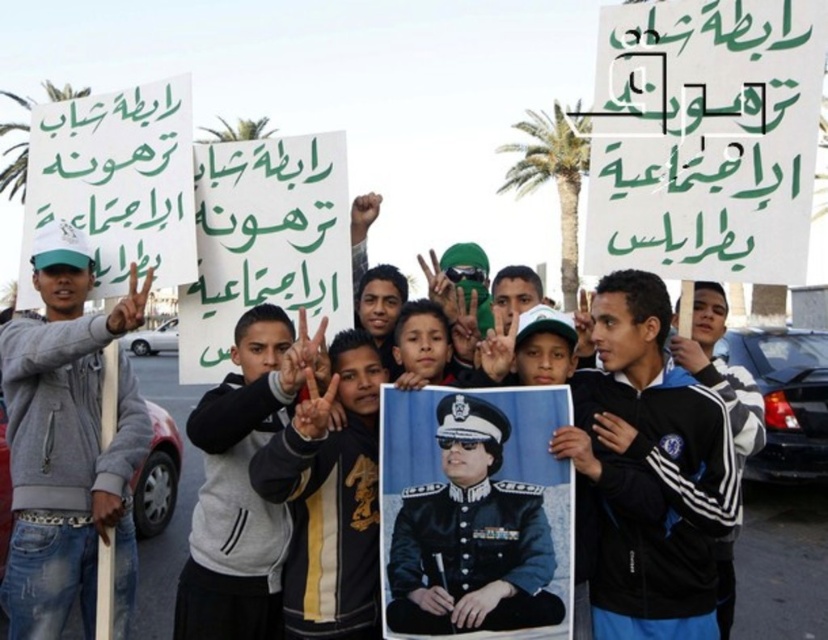
Looking at this image, you are a journalist at the scene of this demonstration. You need to take a photo that includes both the uniformed officer portrait at center and the gray fleece jacket at center. Which object will appear larger in your photo?

The gray fleece jacket at center will appear larger in the photo because the uniformed officer portrait at center is smaller than the gray fleece jacket at center.

You are a journalist trying to capture the most impactful photo of the demonstration. You notice the uniformed officer portrait at center and the gray fleece jacket at center. Which object should you focus on to ensure it is in the foreground of your photo?

You should focus on the uniformed officer portrait at center because the gray fleece jacket at center is behind it, making the officer portrait closer to the camera.